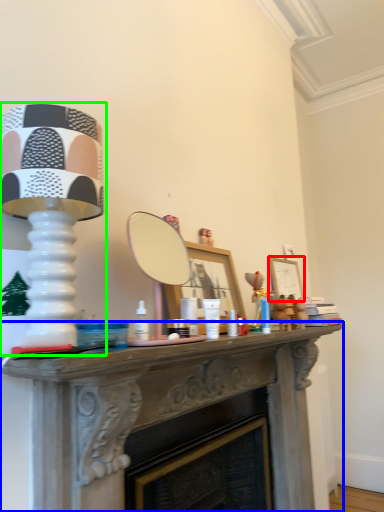
Question: Which object is positioned closest to picture frame (highlighted by a red box)? Select from table (highlighted by a blue box) and table lamp (highlighted by a green box).

Choices:
 (A) table
 (B) table lamp

Answer: (A)